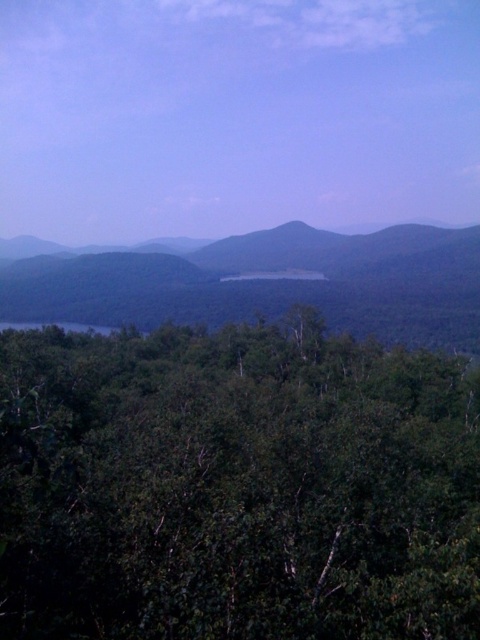
Is point (135, 604) positioned after point (204, 294)?

No, (135, 604) is closer to viewer.

Which is in front, point (115, 561) or point (49, 291)?

Point (115, 561)

Which is in front, point (292, 547) or point (397, 301)?

Point (292, 547) is more forward.

Locate an element on the screen. This screenshot has width=480, height=640. green leafy tree at center is located at coordinates (237, 486).